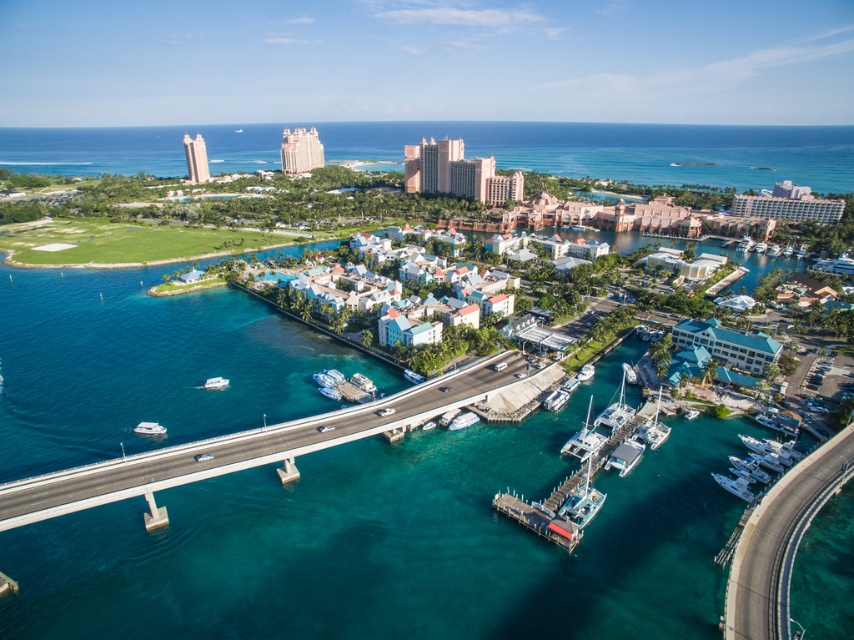
Question: Is clear blue water at center behind concrete bridge at center?

Choices:
 (A) no
 (B) yes

Answer: (A)

Question: Is clear blue water at center wider than white matte boat at center?

Choices:
 (A) no
 (B) yes

Answer: (B)

Question: Where is clear blue water at center located in relation to white matte boat at center in the image?

Choices:
 (A) right
 (B) left

Answer: (B)

Question: Which point is closer to the camera taking this photo?

Choices:
 (A) (597, 417)
 (B) (225, 380)
 (C) (139, 422)

Answer: (A)

Question: Which object is positioned closest to the white matte boat at center?

Choices:
 (A) white matte boat at lower left
 (B) clear blue water at center

Answer: (B)

Question: Which point is closer to the camera?

Choices:
 (A) (59, 488)
 (B) (62, 433)

Answer: (A)